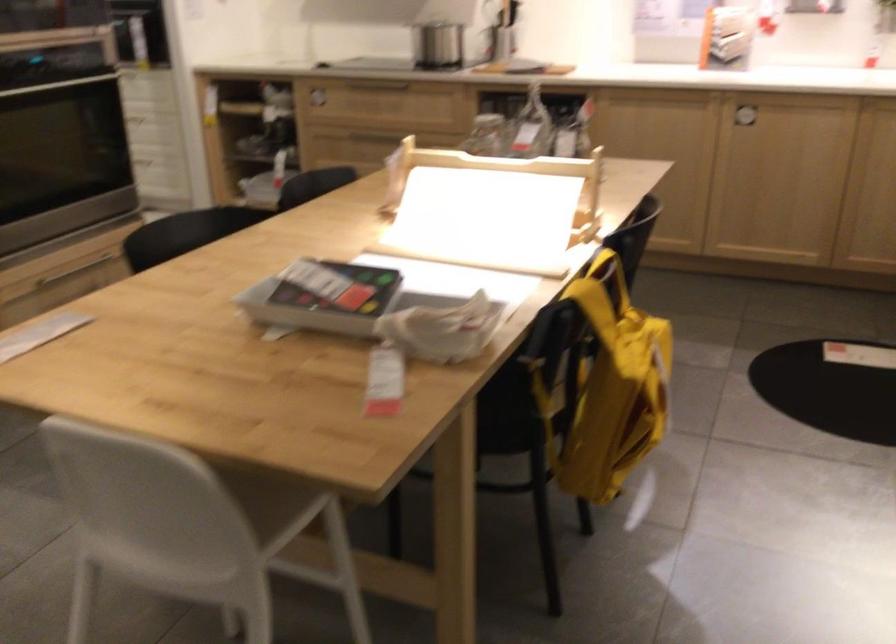
Find the location of `oven door handle`. oven door handle is located at coordinates (53, 73).